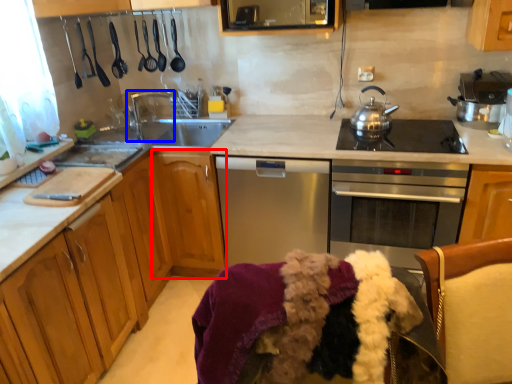
Question: Which of the following is the farthest to the observer, cabinetry (highlighted by a red box) or tap (highlighted by a blue box)?

Choices:
 (A) cabinetry
 (B) tap

Answer: (B)